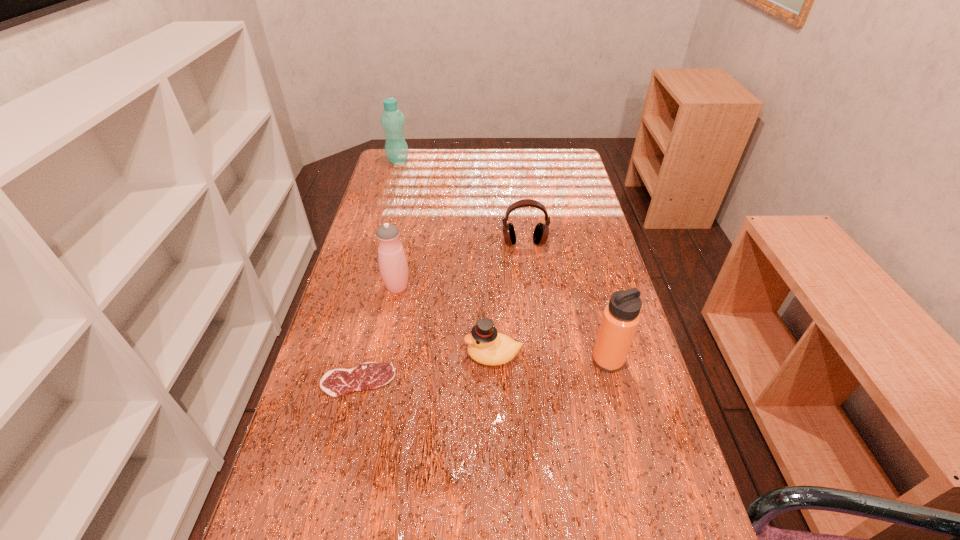
What are the coordinates of `bottle` in the screenshot? It's located at pyautogui.click(x=392, y=120).

Where is `the nearer thermos bottle`? the nearer thermos bottle is located at coordinates (621, 316).

Where is `the rightmost object`? the rightmost object is located at coordinates (621, 316).

This screenshot has width=960, height=540. What are the coordinates of `the third farthest object` in the screenshot? It's located at (393, 265).

In order to click on the left thermos bottle in this screenshot , I will do `click(393, 265)`.

Locate an element on the screen. The height and width of the screenshot is (540, 960). headset is located at coordinates (541, 232).

You are a GUI agent. You are given a task and a screenshot of the screen. Output one action in this format:
    pyautogui.click(x=<x>, y=<y>)
    Task: Click on the third shortest object
    Image resolution: width=960 pixels, height=540 pixels.
    Given the screenshot: What is the action you would take?
    pyautogui.click(x=541, y=232)

At what (x,y) coordinates should I click in order to perform the action: click on duck. Please return your answer as a coordinate pair (x, y). The height and width of the screenshot is (540, 960). Looking at the image, I should click on (486, 346).

Image resolution: width=960 pixels, height=540 pixels. What are the coordinates of `the shortest object` in the screenshot? It's located at (369, 375).

I want to click on vacant space located 0.270m on the front of the farthest object, so click(386, 205).